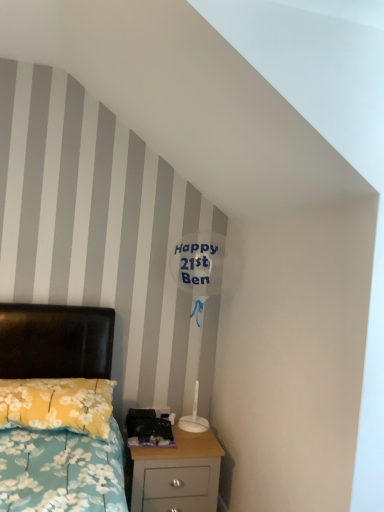
The width and height of the screenshot is (384, 512). In order to click on free space in front of transparent plastic balloon at upper center in this screenshot , I will do `click(182, 446)`.